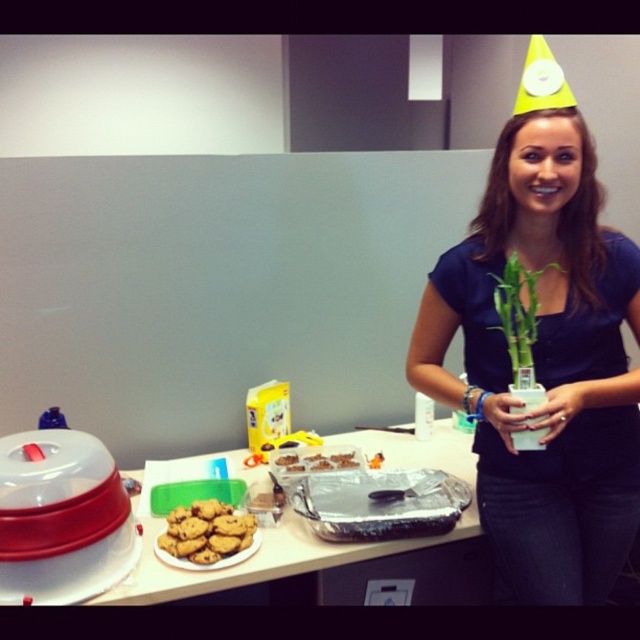
You are planning to place both the green bamboo at center and the chocolate chip cookie dough at center on a shelf. Which one should you place first if you want to ensure the larger item is placed first?

You should place the green bamboo at center first because it is larger in size than the chocolate chip cookie dough at center.

Based on the photo, you are a delivery robot with a height of 1.5 meters. You need to deliver a package to the woman standing at point (515, 264). The ceiling height in this room is 2.5 meters. Can you safely pass through the cubicle partition without hitting your head?

The ceiling height is 2.5 meters and the robot is 1.5 meters tall, so there is enough clearance. The robot can safely pass through the cubicle partition without hitting its head.